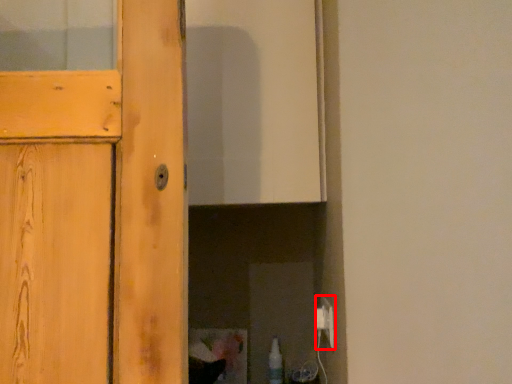
Question: Observing the image, what is the correct spatial positioning of electric outlet (annotated by the red box) in reference to bottle?

Choices:
 (A) right
 (B) left

Answer: (A)